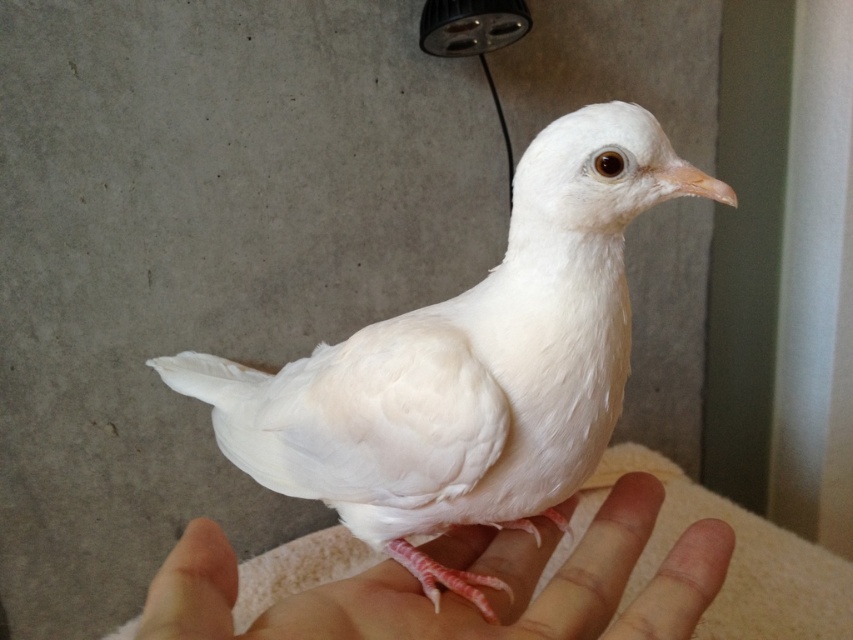
Question: Which point appears closest to the camera in this image?

Choices:
 (A) (556, 292)
 (B) (532, 563)

Answer: (A)

Question: Which point appears closest to the camera in this image?

Choices:
 (A) (612, 593)
 (B) (552, 513)

Answer: (A)

Question: Is white feathered bird at center in front of pink flesh at center?

Choices:
 (A) yes
 (B) no

Answer: (B)

Question: In this image, where is white feathered bird at center located relative to pink flesh at center?

Choices:
 (A) above
 (B) below

Answer: (A)

Question: Is white feathered bird at center below pink flesh at center?

Choices:
 (A) yes
 (B) no

Answer: (B)